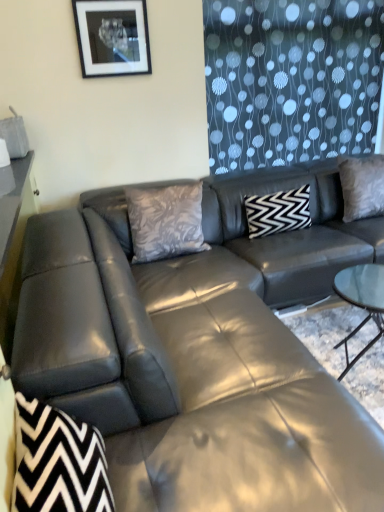
Question: Considering the relative sizes of silky gray pillow at upper right, the 1th pillow positioned from the right, and black zigzag fabric swivel chair at lower left in the image provided, is silky gray pillow at upper right, the 1th pillow positioned from the right, smaller than black zigzag fabric swivel chair at lower left?

Choices:
 (A) yes
 (B) no

Answer: (B)

Question: From the image's perspective, does silky gray pillow at upper right, marked as the 3th pillow in a left-to-right arrangement, appear higher than black zigzag fabric swivel chair at lower left?

Choices:
 (A) no
 (B) yes

Answer: (B)

Question: Is silky gray pillow at upper right, marked as the 3th pillow in a left-to-right arrangement, to the left of black zigzag fabric swivel chair at lower left from the viewer's perspective?

Choices:
 (A) no
 (B) yes

Answer: (A)

Question: Is the surface of silky gray pillow at upper right, the 1th pillow positioned from the right, in direct contact with black zigzag fabric swivel chair at lower left?

Choices:
 (A) no
 (B) yes

Answer: (A)

Question: From a real-world perspective, is silky gray pillow at upper right, marked as the 3th pillow in a left-to-right arrangement, on top of black zigzag fabric swivel chair at lower left?

Choices:
 (A) no
 (B) yes

Answer: (B)

Question: From a real-world perspective, is black and white zigzag pillow at center, the 2th pillow viewed from the right, positioned above or below black zigzag fabric swivel chair at lower left?

Choices:
 (A) below
 (B) above

Answer: (A)

Question: Considering the positions of point (256, 212) and point (41, 452), is point (256, 212) closer or farther from the camera than point (41, 452)?

Choices:
 (A) farther
 (B) closer

Answer: (A)

Question: In the image, is black and white zigzag pillow at center, the 2th pillow viewed from the right, on the left side or the right side of black zigzag fabric swivel chair at lower left?

Choices:
 (A) right
 (B) left

Answer: (A)

Question: Is black and white zigzag pillow at center, acting as the second pillow starting from the left, inside the boundaries of black zigzag fabric swivel chair at lower left, or outside?

Choices:
 (A) outside
 (B) inside

Answer: (A)

Question: Considering the positions of point (301, 216) and point (163, 220), is point (301, 216) closer or farther from the camera than point (163, 220)?

Choices:
 (A) closer
 (B) farther

Answer: (B)

Question: From a real-world perspective, is black and white zigzag pillow at center, acting as the second pillow starting from the left, physically located above or below silky gray pillow at center, arranged as the third pillow when viewed from the right?

Choices:
 (A) below
 (B) above

Answer: (A)

Question: Considering the positions of black and white zigzag pillow at center, the 2th pillow viewed from the right, and silky gray pillow at center, arranged as the third pillow when viewed from the right, in the image, is black and white zigzag pillow at center, the 2th pillow viewed from the right, bigger or smaller than silky gray pillow at center, arranged as the third pillow when viewed from the right,?

Choices:
 (A) small
 (B) big

Answer: (A)

Question: In terms of width, does black and white zigzag pillow at center, acting as the second pillow starting from the left, look wider or thinner when compared to silky gray pillow at center, arranged as the third pillow when viewed from the right?

Choices:
 (A) wide
 (B) thin

Answer: (A)

Question: Choose the correct answer: Is silky gray pillow at upper right, marked as the 3th pillow in a left-to-right arrangement, inside black and white zigzag pillow at center, the 2th pillow viewed from the right, or outside it?

Choices:
 (A) inside
 (B) outside

Answer: (B)

Question: From the image's perspective, is silky gray pillow at upper right, the 1th pillow positioned from the right, above or below black and white zigzag pillow at center, the 2th pillow viewed from the right?

Choices:
 (A) below
 (B) above

Answer: (B)